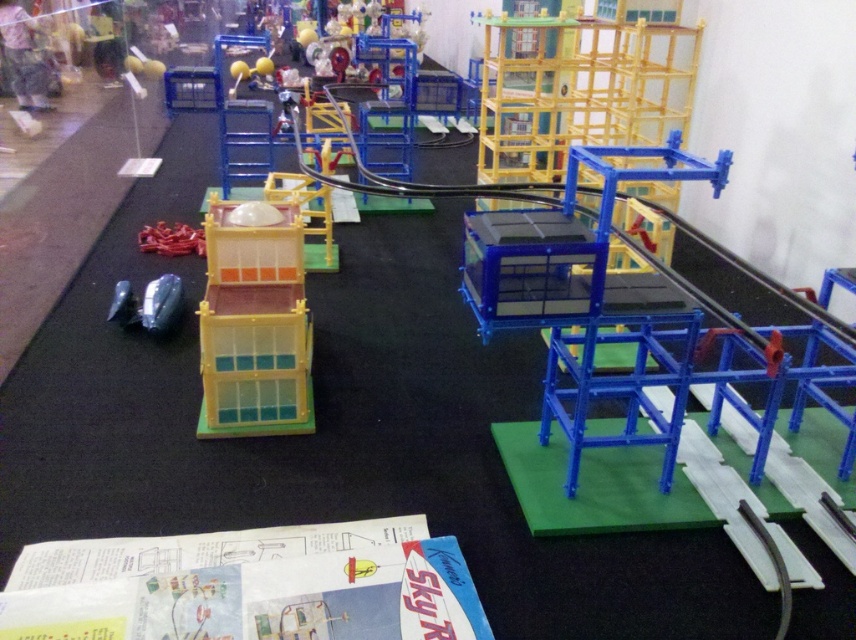
Who is higher up, translucent yellow plastic tower at center-left or glossy plastic toy car at lower left?

glossy plastic toy car at lower left is higher up.

Could you measure the distance between translucent yellow plastic tower at center-left and glossy plastic toy car at lower left?

The distance of translucent yellow plastic tower at center-left from glossy plastic toy car at lower left is 28.89 inches.

What do you see at coordinates (254, 326) in the screenshot? I see `translucent yellow plastic tower at center-left` at bounding box center [254, 326].

This screenshot has width=856, height=640. Identify the location of translucent yellow plastic tower at center-left. (254, 326).